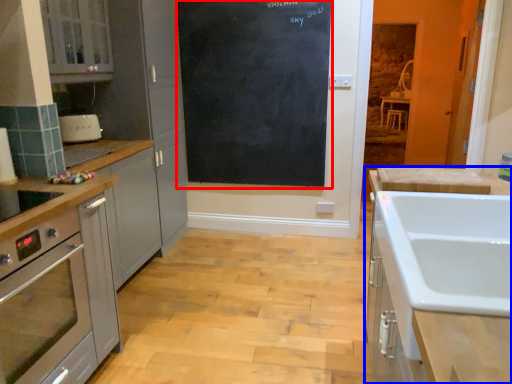
Question: Which point is closer to the camera, bulletin board (highlighted by a red box) or cabinetry (highlighted by a blue box)?

Choices:
 (A) bulletin board
 (B) cabinetry

Answer: (B)